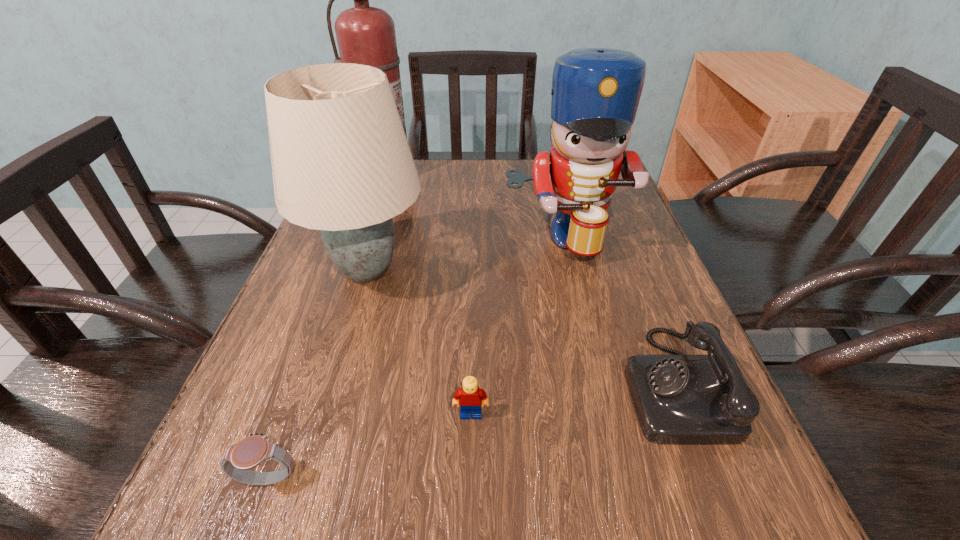
Where is `vacant space situated on the dial of the telephone`? vacant space situated on the dial of the telephone is located at coordinates (404, 384).

Identify the location of free point located 0.370m on the dial of the telephone. The height and width of the screenshot is (540, 960). (392, 384).

Locate an element on the screen. Image resolution: width=960 pixels, height=540 pixels. vacant region located 0.360m on the dial of the telephone is located at coordinates (398, 384).

This screenshot has width=960, height=540. I want to click on blank space located 0.050m on the front-facing side of the Lego, so click(x=470, y=453).

At what (x,y) coordinates should I click in order to perform the action: click on free space located 0.170m on the right of the watch. Please return your answer as a coordinate pair (x, y). Looking at the image, I should click on (430, 478).

Where is `object located at the far edge`? object located at the far edge is located at coordinates (366, 35).

You are a GUI agent. You are given a task and a screenshot of the screen. Output one action in this format:
    pyautogui.click(x=<x>, y=<y>)
    Task: Click on the object located at the near edge
    
    Given the screenshot: What is the action you would take?
    pyautogui.click(x=253, y=450)

This screenshot has width=960, height=540. I want to click on fire extinguisher that is at the left edge, so click(366, 35).

Identify the location of lampshade that is at the left edge. This screenshot has width=960, height=540. (341, 163).

This screenshot has height=540, width=960. What are the coordinates of `watch that is positioned at the left edge` in the screenshot? It's located at (253, 450).